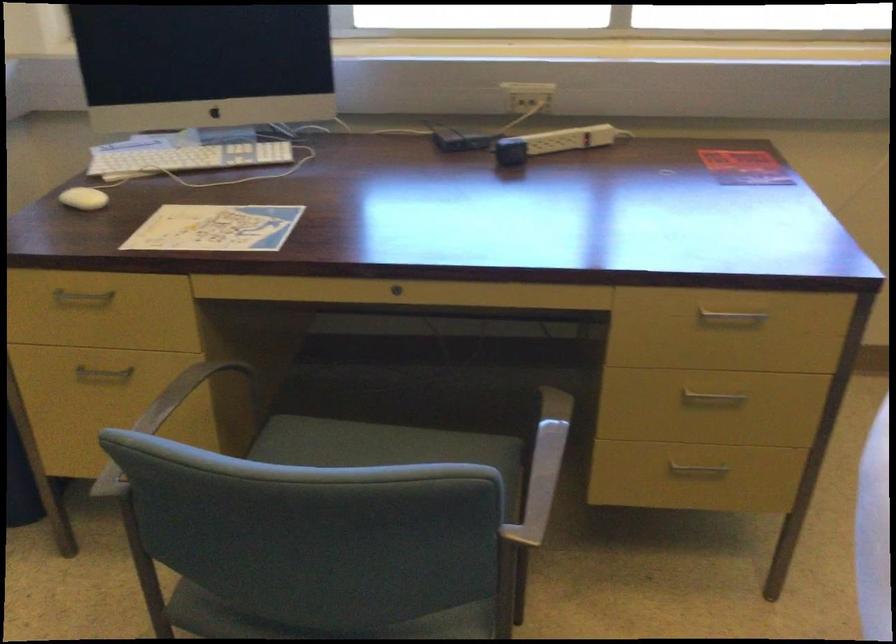
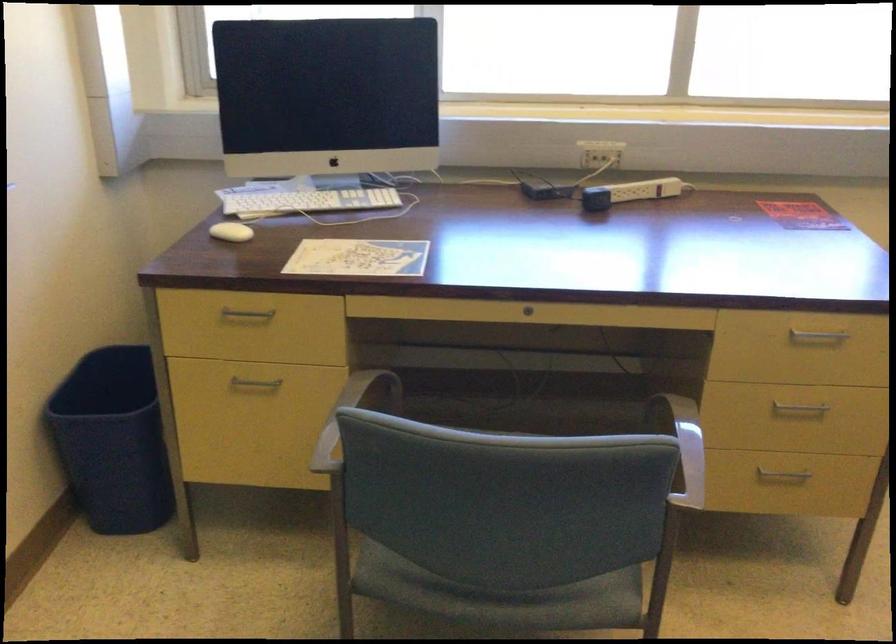
Locate, in the second image, the point that corresponds to [102,373] in the first image.

(254, 384)